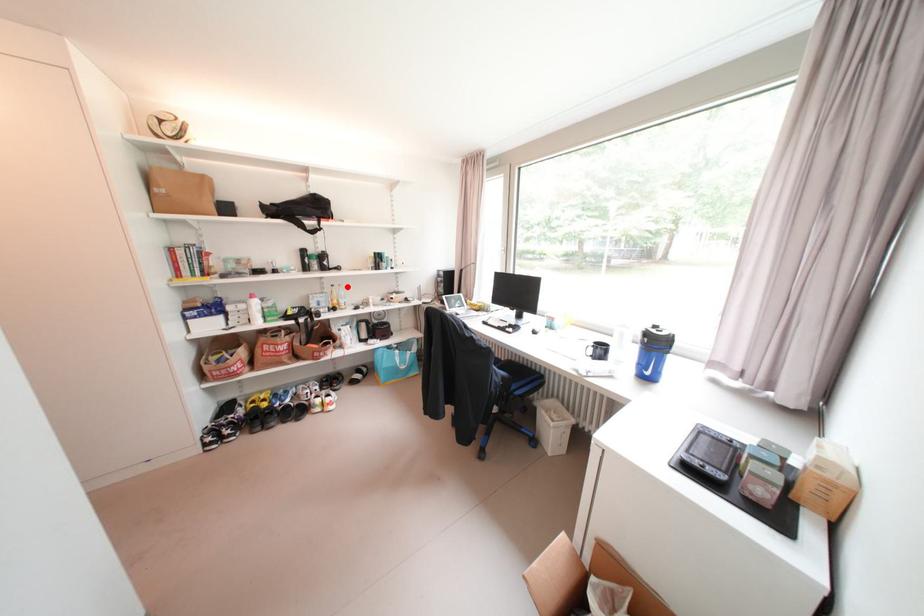
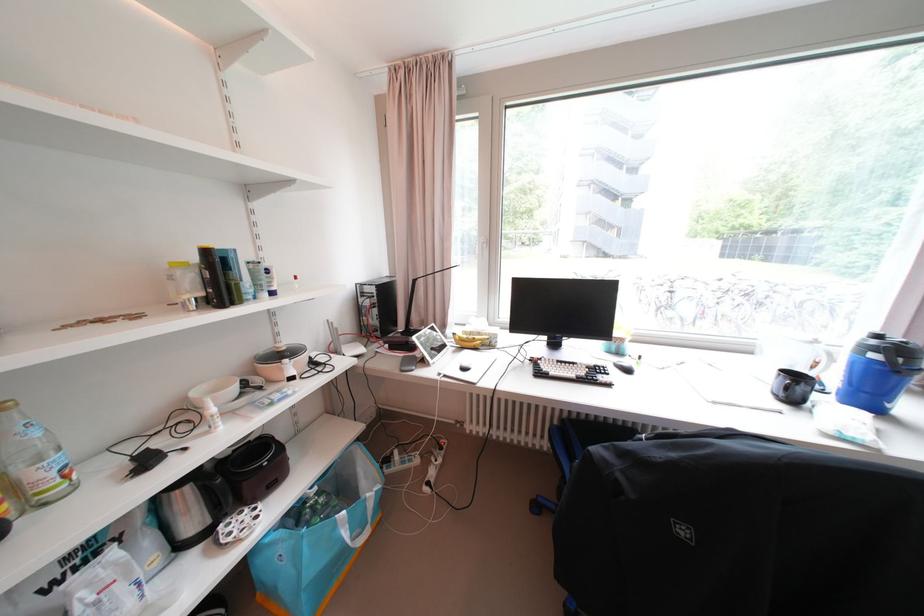
Question: I am providing you with two images of the same scene from different viewpoints. A red point is shown in image1. For the corresponding object point in image2, is it positioned nearer or farther from the camera?

Choices:
 (A) Nearer
 (B) Farther

Answer: (B)